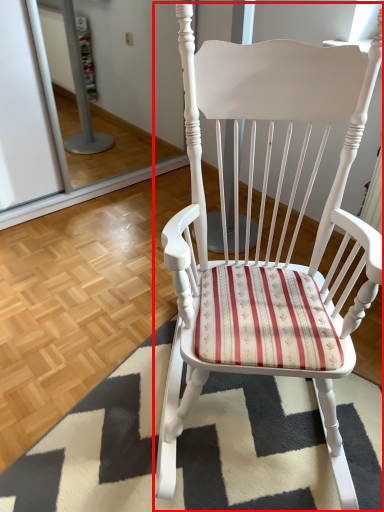
Question: Considering the relative positions of chair (annotated by the red box) and doormat in the image provided, where is chair (annotated by the red box) located with respect to the staircase?

Choices:
 (A) left
 (B) right

Answer: (B)